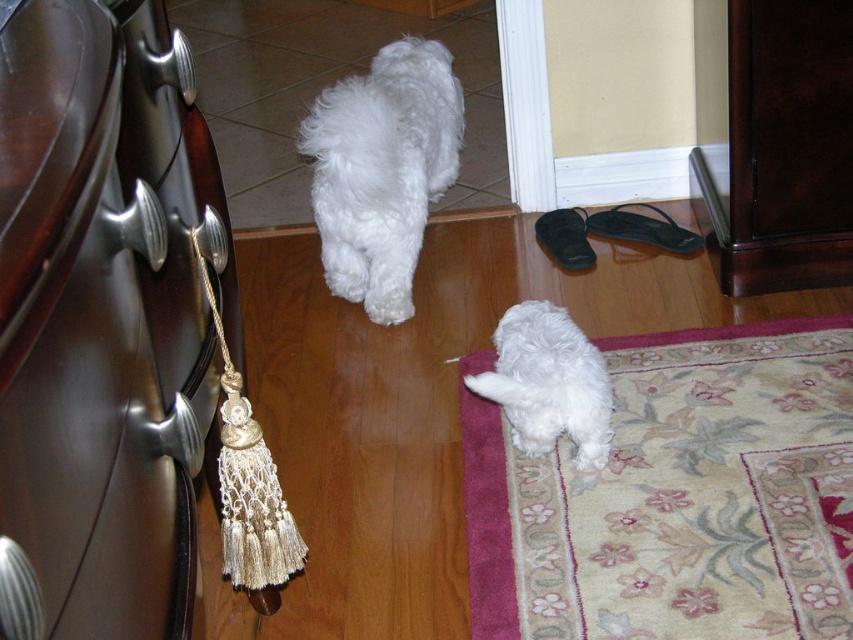
Is shiny dark wood drawer at left shorter than white fluffy dog at center?

Indeed, shiny dark wood drawer at left has a lesser height compared to white fluffy dog at center.

Identify the location of shiny dark wood drawer at left. (86, 353).

Find the location of a particular element. This screenshot has height=640, width=853. shiny dark wood drawer at left is located at coordinates (86, 353).

Based on the photo, which is below, shiny dark wood drawer at left or dark brown wood dresser at lower right?

shiny dark wood drawer at left is lower down.

What do you see at coordinates (86, 353) in the screenshot? The image size is (853, 640). I see `shiny dark wood drawer at left` at bounding box center [86, 353].

Does point (148, 257) come in front of point (730, 237)?

Yes, point (148, 257) is in front of point (730, 237).

Identify the location of shiny dark wood drawer at left. (86, 353).

Is point (758, 48) less distant than point (451, 80)?

Yes, it is in front of point (451, 80).

Consider the image. Is dark brown wood dresser at lower right below white fluffy dog at center?

Actually, dark brown wood dresser at lower right is above white fluffy dog at center.

Where is `dark brown wood dresser at lower right`? dark brown wood dresser at lower right is located at coordinates (784, 148).

Find the location of a particular element. This screenshot has height=640, width=853. dark brown wood dresser at lower right is located at coordinates (784, 148).